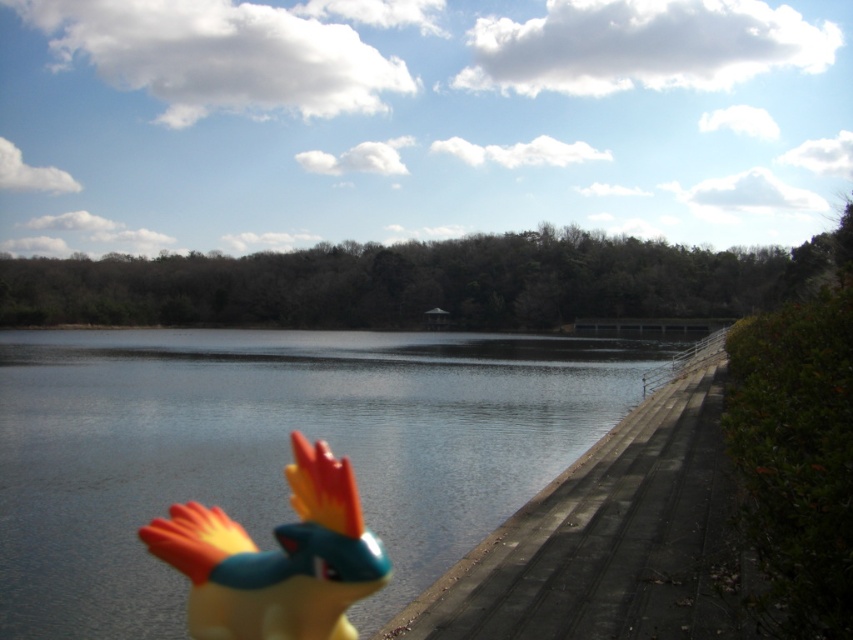
You are a photographer trying to capture a wide shot of the scene. Your camera can focus on objects up to 25 meters away. Is the concrete at right within the camera focus range of the shiny plastic bird at lower left?

The distance between the concrete at right and the shiny plastic bird at lower left is 20.98 meters, which is within the camera focus range of up to 25 meters. Therefore, the concrete at right is within the focus range of the shiny plastic bird at lower left.

You are a photographer trying to capture a clear shot of the shiny plastic bird at lower left and the glossy water at lower left. Which object should you focus on first if you want both to be in focus?

The glossy water at lower left is positioned on the left side of the shiny plastic bird at lower left. To have both in focus, you should focus on the shiny plastic bird at lower left first since it is closer to the camera, allowing the glossy water at lower left to be within the depth of field.